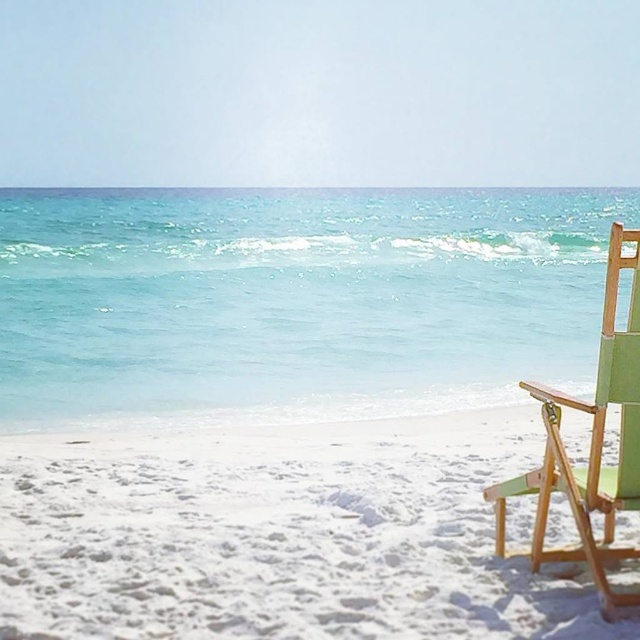
Question: Is white sandy beach at lower right smaller than green fabric chair at right?

Choices:
 (A) yes
 (B) no

Answer: (B)

Question: Which of the following is the farthest from the observer?

Choices:
 (A) (545, 456)
 (B) (52, 552)

Answer: (B)

Question: Is white sandy beach at lower right below green fabric chair at right?

Choices:
 (A) no
 (B) yes

Answer: (B)

Question: Is white sandy beach at lower right to the right of green fabric chair at right from the viewer's perspective?

Choices:
 (A) yes
 (B) no

Answer: (B)

Question: Which point appears farthest from the camera in this image?

Choices:
 (A) (593, 442)
 (B) (483, 513)

Answer: (B)

Question: Which point is closer to the camera?

Choices:
 (A) (611, 390)
 (B) (138, 632)

Answer: (A)